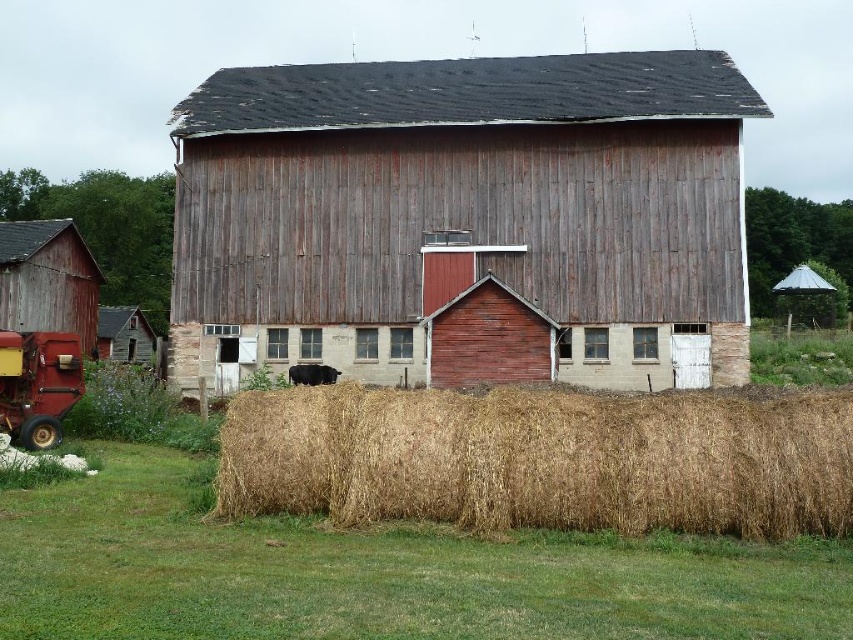
You are standing at the edge of the farm field and see the wooden barn at center and the metallic red tractor at lower left. Which object is positioned higher in the image?

The wooden barn at center is positioned higher than the metallic red tractor at lower left.

You are a farmer planning to move the metallic red tractor at lower left to the right side of the rustic wood barn at left. Given the barn is larger, will the tractor fit on the right side without overlapping the barn?

The rustic wood barn at left has a larger size compared to the metallic red tractor at lower left. Since the barn is bigger, moving the tractor to its right side should be possible as long as there is enough space, but the description does not provide exact dimensions of the area. However, since the barn is larger, it likely occupies more space, so the tractor might need to be positioned carefully to avoid overlapping.

You are a farmer who needs to move the metallic red tractor at lower left to the other side of the barn. Which direction should you drive the tractor so that it ends up to the left of the brown straw bales at lower center?

You should drive the tractor to the right because the brown straw bales at lower center are currently to the right of the metallic red tractor at lower left. Moving it to the right would place it on the opposite side of the barn, ending up to the left of the bales.